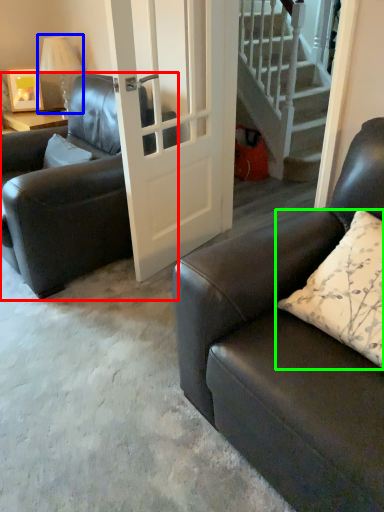
Question: Which object is the closest to the chair (highlighted by a red box)? Choose among these: lamp (highlighted by a blue box) or pillow (highlighted by a green box).

Choices:
 (A) lamp
 (B) pillow

Answer: (A)